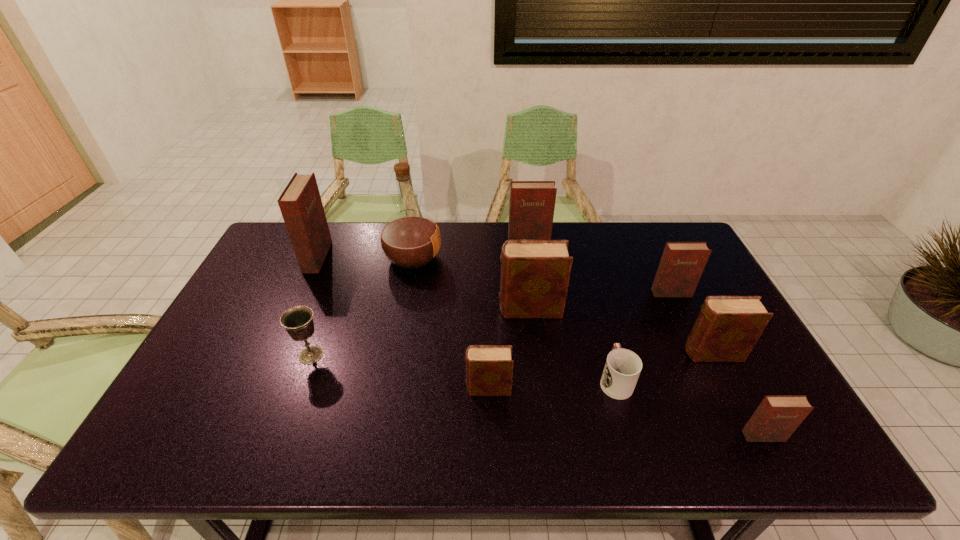
Locate an element on the screen. The height and width of the screenshot is (540, 960). the tallest object is located at coordinates click(x=410, y=239).

Locate an element on the screen. The height and width of the screenshot is (540, 960). the third object from left to right is located at coordinates (410, 239).

Locate an element on the screen. The image size is (960, 540). the leftmost object is located at coordinates (300, 203).

Find the location of a particular element. The image size is (960, 540). the leftmost reddish-brown diary is located at coordinates (300, 203).

The height and width of the screenshot is (540, 960). I want to click on the farthest brown diary, so click(535, 274).

The width and height of the screenshot is (960, 540). What are the coordinates of `the fourth nearest diary` in the screenshot? It's located at (535, 274).

This screenshot has width=960, height=540. Find the location of `the third smallest reddish-brown diary`. the third smallest reddish-brown diary is located at coordinates (532, 203).

At what (x,y) coordinates should I click in order to perform the action: click on the fourth farthest object. Please return your answer as a coordinate pair (x, y). This screenshot has height=540, width=960. Looking at the image, I should click on (682, 263).

Image resolution: width=960 pixels, height=540 pixels. I want to click on the third farthest reddish-brown diary, so [x=682, y=263].

I want to click on the rightmost brown diary, so click(727, 328).